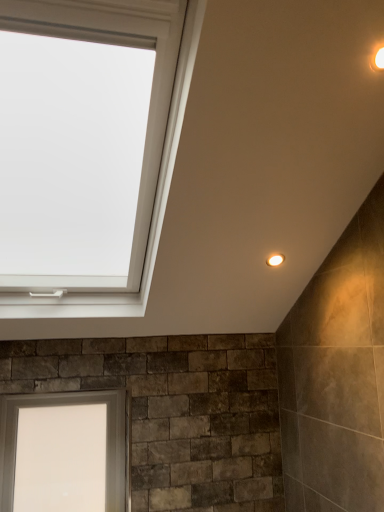
Question: Is white glass window at lower left touching warm matte light fixture at upper right, which is the 1th light fixture in front-to-back order?

Choices:
 (A) yes
 (B) no

Answer: (B)

Question: Are white glass window at lower left and warm matte light fixture at upper right, the second light fixture from the left, located far from each other?

Choices:
 (A) yes
 (B) no

Answer: (A)

Question: Is the position of white glass window at lower left less distant than that of warm matte light fixture at upper right, which is the 1th light fixture in front-to-back order?

Choices:
 (A) no
 (B) yes

Answer: (A)

Question: Is white glass window at lower left at the right side of warm matte light fixture at upper right, the second light fixture when ordered from back to front?

Choices:
 (A) no
 (B) yes

Answer: (A)

Question: From the image's perspective, would you say white glass window at lower left is positioned over warm matte light fixture at upper right, the second light fixture in the bottom-to-top sequence?

Choices:
 (A) yes
 (B) no

Answer: (B)

Question: Is matte white light fixture at upper right, the 2th light fixture from the top, inside the boundaries of warm matte light fixture at upper right, the second light fixture in the bottom-to-top sequence, or outside?

Choices:
 (A) inside
 (B) outside

Answer: (B)

Question: In terms of height, does matte white light fixture at upper right, acting as the 2th light fixture starting from the right, look taller or shorter compared to warm matte light fixture at upper right, the second light fixture when ordered from back to front?

Choices:
 (A) tall
 (B) short

Answer: (A)

Question: In terms of width, does matte white light fixture at upper right, which is counted as the 1th light fixture, starting from the bottom, look wider or thinner when compared to warm matte light fixture at upper right, which is counted as the first light fixture, starting from the top?

Choices:
 (A) thin
 (B) wide

Answer: (B)

Question: From a real-world perspective, relative to warm matte light fixture at upper right, which is the first light fixture in right-to-left order, is matte white light fixture at upper right, the first light fixture viewed from the left, vertically above or below?

Choices:
 (A) below
 (B) above

Answer: (A)

Question: In the image, is white glass window at lower left on the left side or the right side of warm matte light fixture at upper right, the second light fixture when ordered from back to front?

Choices:
 (A) left
 (B) right

Answer: (A)

Question: From a real-world perspective, is white glass window at lower left positioned above or below warm matte light fixture at upper right, the second light fixture in the bottom-to-top sequence?

Choices:
 (A) below
 (B) above

Answer: (A)

Question: Looking at the image, does white glass window at lower left seem bigger or smaller compared to warm matte light fixture at upper right, the second light fixture when ordered from back to front?

Choices:
 (A) small
 (B) big

Answer: (B)

Question: Relative to warm matte light fixture at upper right, the second light fixture in the bottom-to-top sequence, is white glass window at lower left in front or behind?

Choices:
 (A) behind
 (B) front

Answer: (A)

Question: From the image's perspective, is warm matte light fixture at upper right, which is the first light fixture in right-to-left order, positioned above or below white glass window at lower left?

Choices:
 (A) above
 (B) below

Answer: (A)

Question: Considering the positions of warm matte light fixture at upper right, which is the 1th light fixture in front-to-back order, and white glass window at lower left in the image, is warm matte light fixture at upper right, which is the 1th light fixture in front-to-back order, wider or thinner than white glass window at lower left?

Choices:
 (A) thin
 (B) wide

Answer: (A)